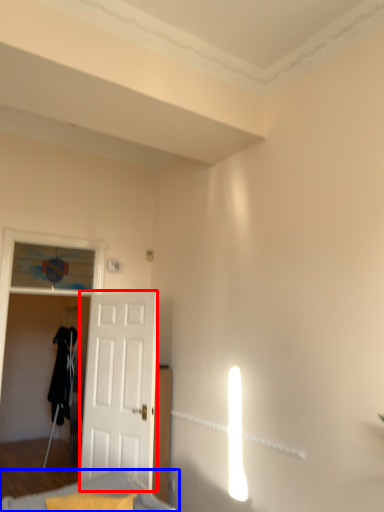
Question: Which object appears farthest to the camera in this image, door (highlighted by a red box) or furniture (highlighted by a blue box)?

Choices:
 (A) door
 (B) furniture

Answer: (A)